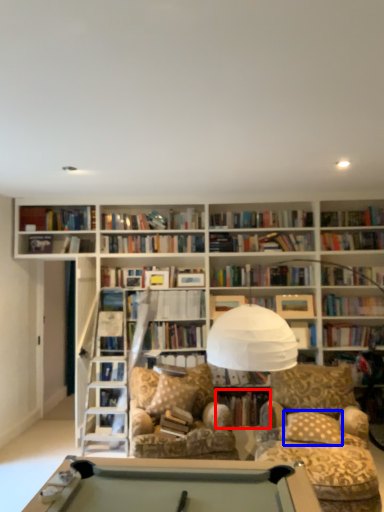
Question: Which point is further to the camera, book (highlighted by a red box) or pillow (highlighted by a blue box)?

Choices:
 (A) book
 (B) pillow

Answer: (A)